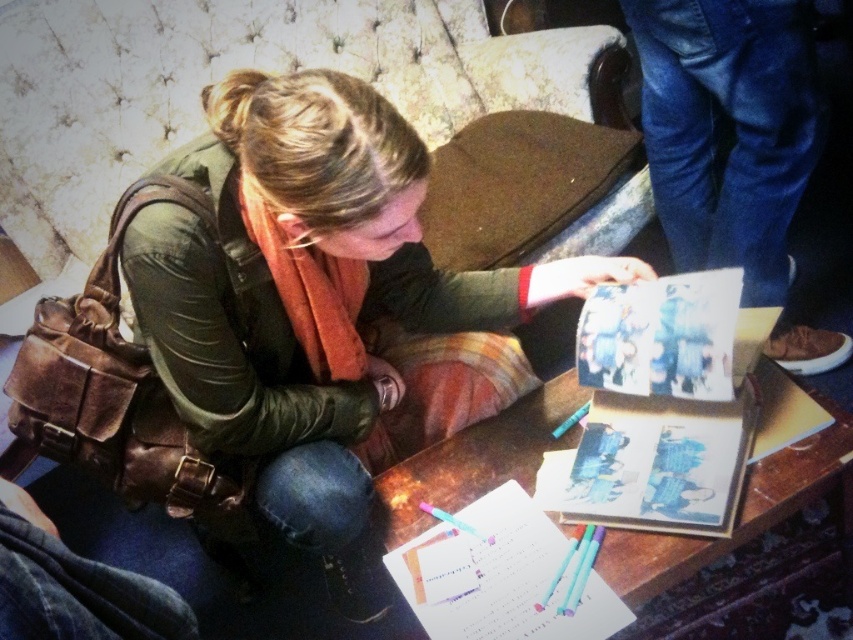
Question: Among these points, which one is farthest from the camera?

Choices:
 (A) (198, 380)
 (B) (432, 461)

Answer: (B)

Question: Does matte green jacket at center appear on the left side of wooden table at center?

Choices:
 (A) no
 (B) yes

Answer: (B)

Question: Is matte green jacket at center to the left of wooden table at center from the viewer's perspective?

Choices:
 (A) no
 (B) yes

Answer: (B)

Question: Which of the following is the farthest from the observer?

Choices:
 (A) (306, 506)
 (B) (389, 529)

Answer: (B)

Question: Does matte green jacket at center have a smaller size compared to wooden table at center?

Choices:
 (A) no
 (B) yes

Answer: (A)